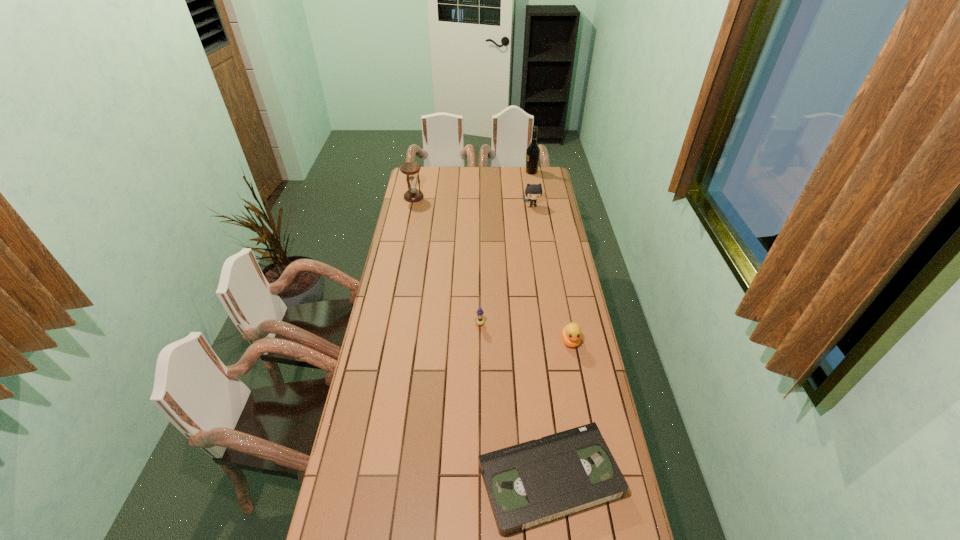
At what (x,y) coordinates should I click in order to perform the action: click on object located at the left edge. Please return your answer as a coordinate pair (x, y). Looking at the image, I should click on click(410, 169).

Locate an element on the screen. Image resolution: width=960 pixels, height=540 pixels. wine bottle at the right edge is located at coordinates (533, 151).

At what (x,y) coordinates should I click in order to perform the action: click on kitten that is at the right edge. Please return your answer as a coordinate pair (x, y). This screenshot has width=960, height=540. Looking at the image, I should click on coord(533,191).

Identify the location of duckling present at the right edge. This screenshot has height=540, width=960. (570, 333).

Locate an element on the screen. videotape present at the right edge is located at coordinates (538, 481).

The width and height of the screenshot is (960, 540). I want to click on object that is positioned at the far right corner, so click(533, 151).

The height and width of the screenshot is (540, 960). In the image, there is a desktop. In order to click on free space at the far edge in this screenshot , I will do `click(499, 181)`.

Find the location of a particular element. free point at the left edge is located at coordinates click(370, 459).

In order to click on vacant region at the right edge of the desktop in this screenshot , I will do `click(554, 262)`.

Image resolution: width=960 pixels, height=540 pixels. In the image, there is a desktop. Identify the location of free space at the far left corner. (420, 172).